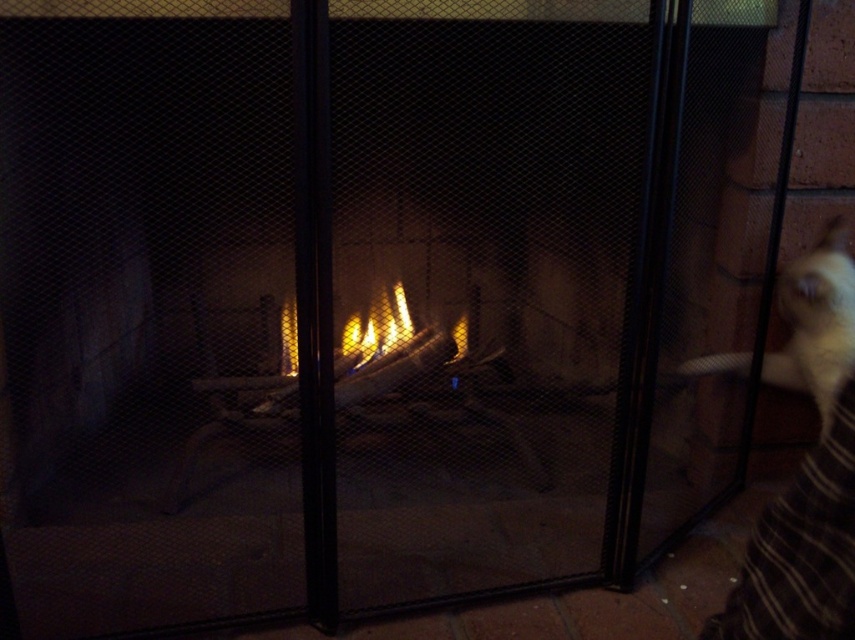
Does white fur cat at right have a lesser width compared to flametransparentfire at center?

Yes.

Does point (826, 376) lie in front of point (354, 369)?

Yes, it is in front of point (354, 369).

Find the location of a particular element. white fur cat at right is located at coordinates (817, 321).